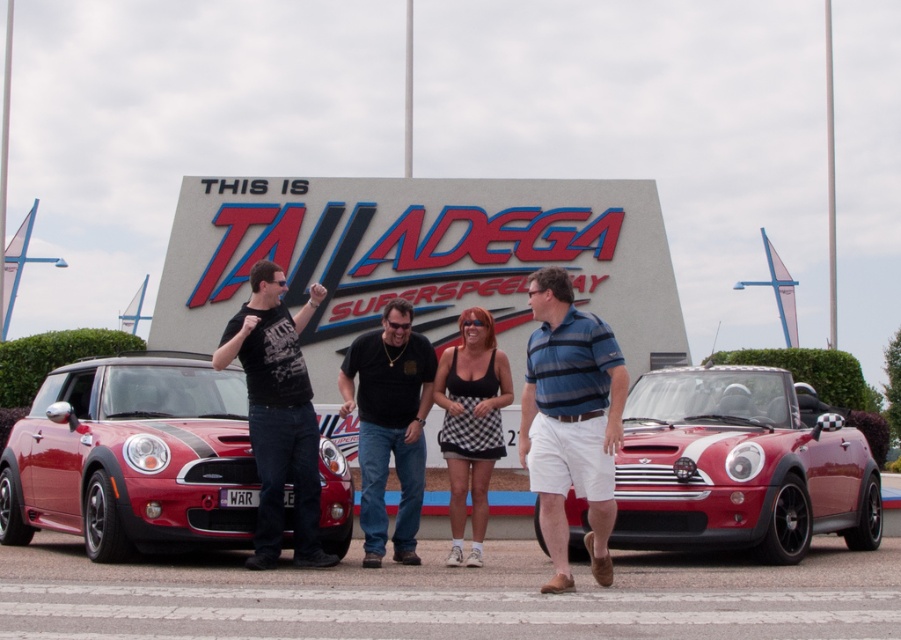
Question: Among these points, which one is farthest from the camera?

Choices:
 (A) (478, 400)
 (B) (420, 481)

Answer: (A)

Question: Does black matte shirt at center have a lesser width compared to black mesh tank top at center?

Choices:
 (A) no
 (B) yes

Answer: (A)

Question: Which point is farther to the camera?

Choices:
 (A) (836, 516)
 (B) (184, 524)
 (C) (529, 440)
 (D) (444, 355)

Answer: (A)

Question: Observing the image, what is the correct spatial positioning of shiny red convertible at center in reference to black matte shirt at center?

Choices:
 (A) above
 (B) below

Answer: (B)

Question: Is shiny red car at center to the left of blue striped polo shirt at center from the viewer's perspective?

Choices:
 (A) yes
 (B) no

Answer: (A)

Question: Among these points, which one is farthest from the camera?

Choices:
 (A) (566, 333)
 (B) (743, 426)
 (C) (253, 291)
 (D) (115, 378)

Answer: (D)